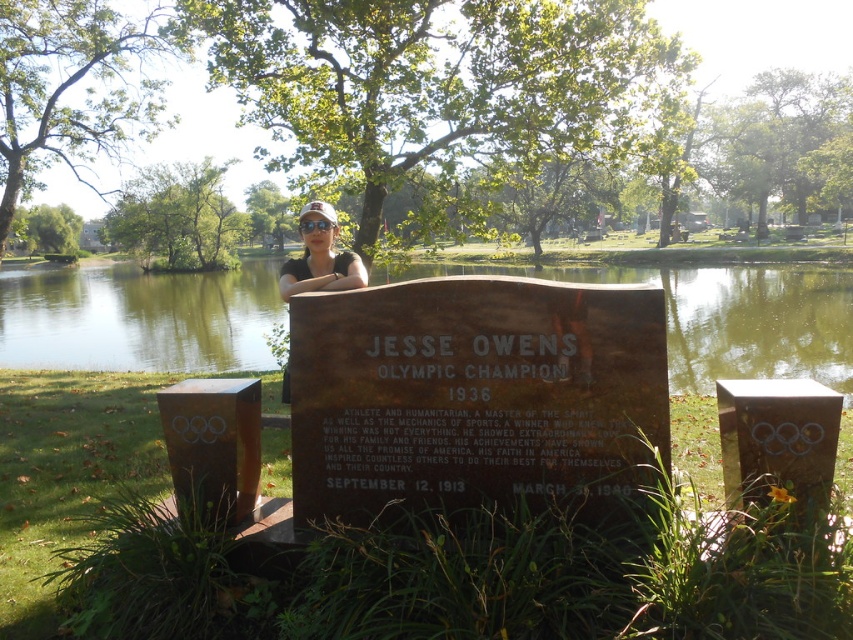
Question: Does green water at pond center appear under matte black cap at upper center?

Choices:
 (A) yes
 (B) no

Answer: (B)

Question: Which point is farther to the camera?

Choices:
 (A) (28, 307)
 (B) (314, 253)

Answer: (A)

Question: Is green water at pond center wider than matte black cap at upper center?

Choices:
 (A) yes
 (B) no

Answer: (A)

Question: Does green water at pond center have a lesser width compared to matte black cap at upper center?

Choices:
 (A) yes
 (B) no

Answer: (B)